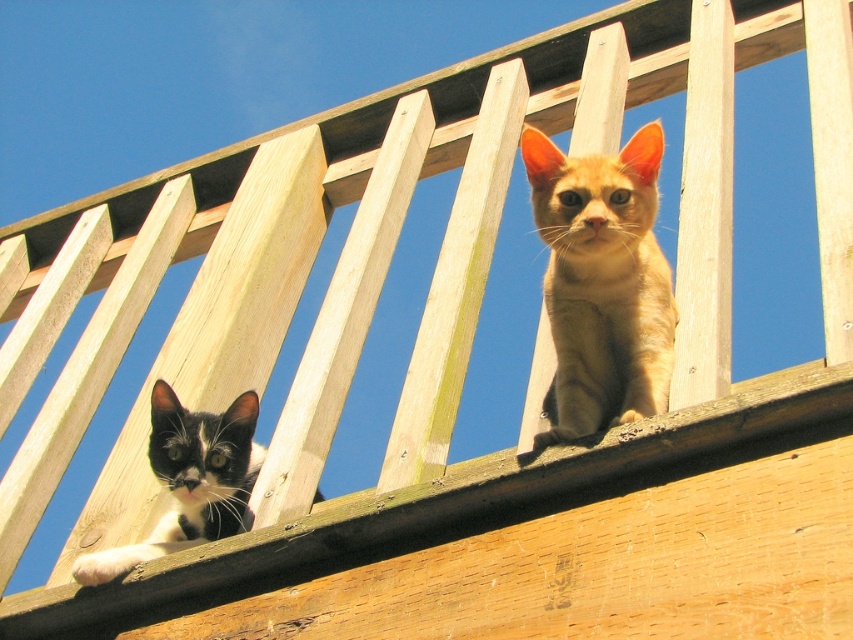
You are a photographer trying to capture both the golden fur cat at upper right and the black and white fur cat at lower left in a single frame. Which cat is positioned to the right side of the other?

The golden fur cat at upper right is positioned to the right of the black and white fur cat at lower left.

You are standing in the scene and notice a point marked at coordinates [601,284]. Which object from the scene does this point belong to?

The point at coordinates [601,284] is located on the golden fur cat at upper right.

You are a photographer trying to capture both the golden fur cat at upper right and the black and white fur cat at lower left in a single frame. Given their sizes, which cat would appear bigger in the photo?

The golden fur cat at upper right would appear bigger in the photo because it has a larger size compared to the black and white fur cat at lower left.